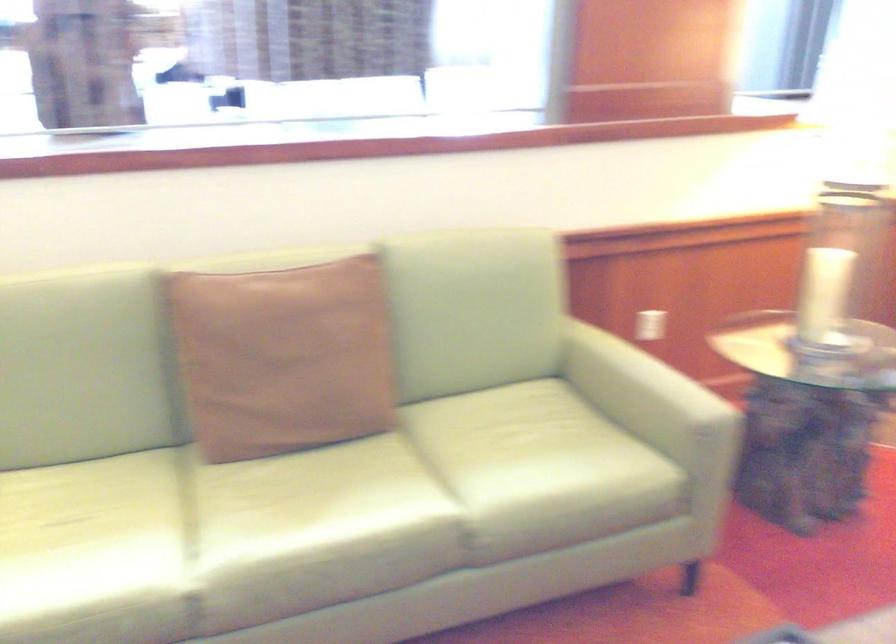
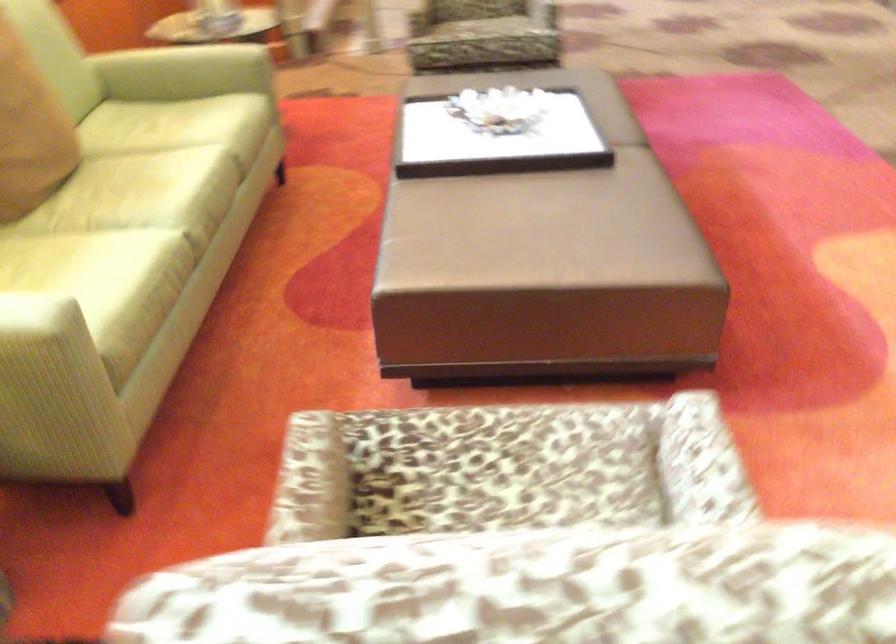
Find the pixel in the second image that matches point (618, 398) in the first image.

(194, 60)